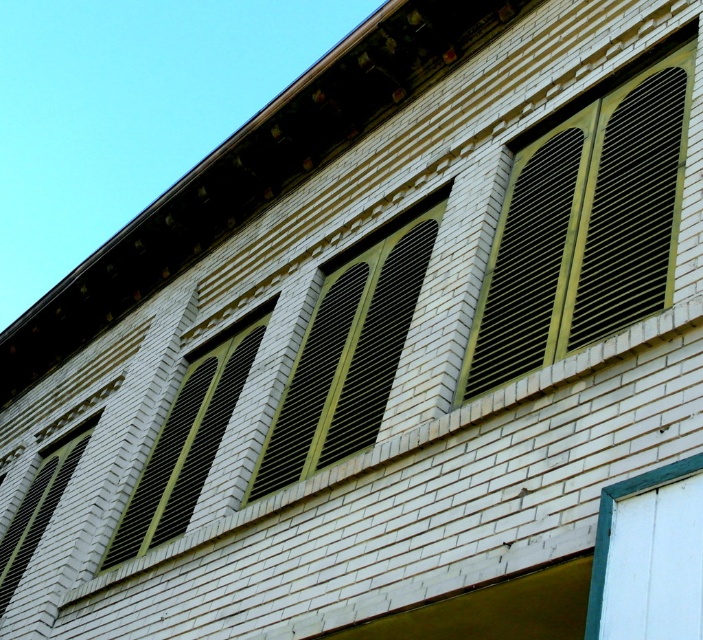
You are standing in front of a building with green matte shutters at center. If the shutters are 106.65 feet away from you, would you need to use a ladder to reach them?

The green matte shutters at center are 106.65 feet away from the viewer, so no, you would not need a ladder since the distance is too far for a typical ladder to reach.

You are an architect inspecting the building facade. You notice the green matte shutters at center and the matte black window at lower left. Which object occupies more space on the wall?

The green matte shutters at center has a larger size compared to the matte black window at lower left, so it occupies more space on the wall.